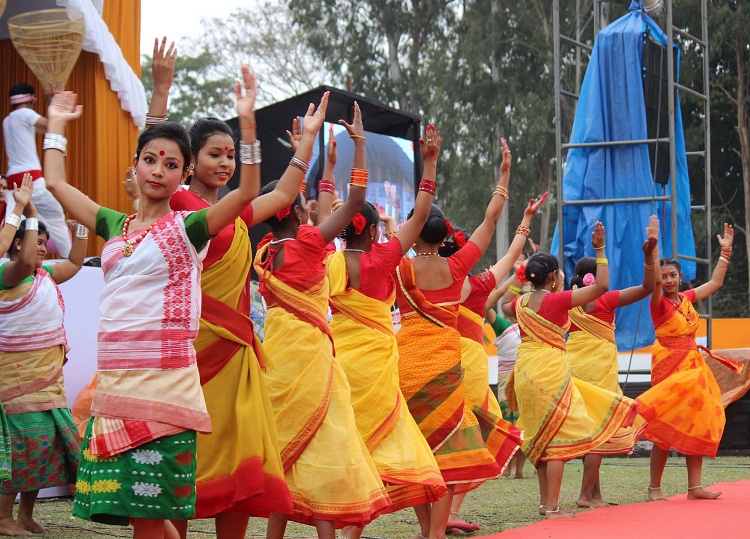
The height and width of the screenshot is (539, 750). Find the location of `fabric`. fabric is located at coordinates tap(157, 327).